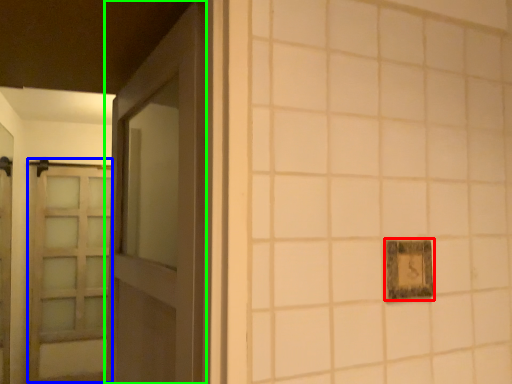
Question: Which is nearer to the picture frame (highlighted by a red box)? barn door (highlighted by a blue box) or door (highlighted by a green box).

Choices:
 (A) barn door
 (B) door

Answer: (B)